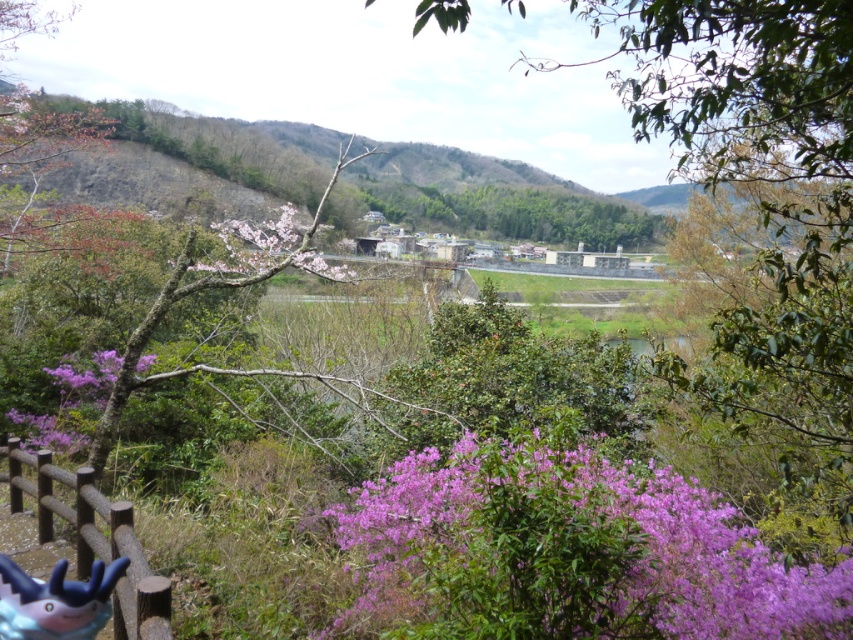
Does brown wooden rail at lower left appear on the left side of plastic toy at lower left?

Correct, you'll find brown wooden rail at lower left to the left of plastic toy at lower left.

Image resolution: width=853 pixels, height=640 pixels. What do you see at coordinates (96, 540) in the screenshot?
I see `brown wooden rail at lower left` at bounding box center [96, 540].

Is point (85, 573) in front of point (20, 582)?

That is False.

This screenshot has width=853, height=640. What are the coordinates of `brown wooden rail at lower left` in the screenshot? It's located at (96, 540).

Is brown wooden rail at lower left further to the viewer compared to purple matte flower at lower left?

No, it is not.

Between point (154, 586) and point (39, 413), which one is positioned behind?

The point (39, 413) is behind.

Is point (91, 492) positioned before point (56, 448)?

Yes, it is.

Where is `brown wooden rail at lower left`? This screenshot has width=853, height=640. brown wooden rail at lower left is located at coordinates (96, 540).

Between point (651, 108) and point (96, 579), which one is positioned in front?

Point (96, 579) is more forward.

In the scene shown: Who is more distant from viewer, (831, 333) or (1, 557)?

The point (1, 557) is more distant.

Does point (846, 513) come behind point (50, 605)?

Yes.

Where is `purple leafy bush at lower center`? The width and height of the screenshot is (853, 640). purple leafy bush at lower center is located at coordinates (761, 221).